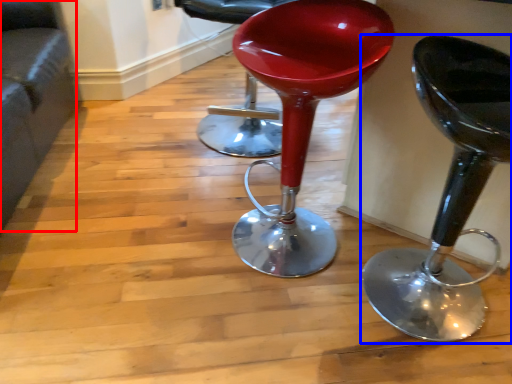
Question: Which object appears farthest to the camera in this image, couch (highlighted by a red box) or stool (highlighted by a blue box)?

Choices:
 (A) couch
 (B) stool

Answer: (A)